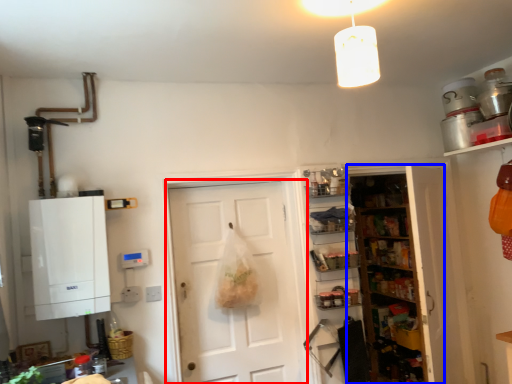
Question: Which of the following is the closest to the observer, door (highlighted by a red box) or shelf (highlighted by a blue box)?

Choices:
 (A) door
 (B) shelf

Answer: (A)